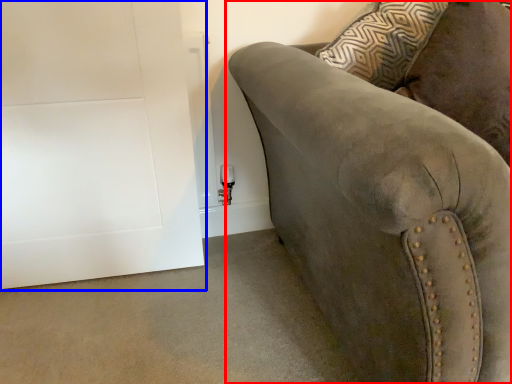
Question: Which point is further to the camera, studio couch (highlighted by a red box) or door (highlighted by a blue box)?

Choices:
 (A) studio couch
 (B) door

Answer: (B)